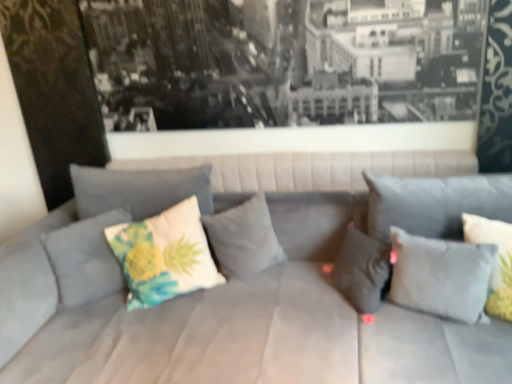
Question: Considering the relative sizes of floral fabric pillow at center, marked as the 6th pillow in a right-to-left arrangement, and white fabric pillow with pineapple print at center, which is the 2th pillow from left to right, in the image provided, is floral fabric pillow at center, marked as the 6th pillow in a right-to-left arrangement, shorter than white fabric pillow with pineapple print at center, which is the 2th pillow from left to right,?

Choices:
 (A) yes
 (B) no

Answer: (A)

Question: Does floral fabric pillow at center, marked as the 6th pillow in a right-to-left arrangement, come behind white fabric pillow with pineapple print at center, which is the 2th pillow from left to right?

Choices:
 (A) no
 (B) yes

Answer: (B)

Question: Is floral fabric pillow at center, marked as the 6th pillow in a right-to-left arrangement, aimed at white fabric pillow with pineapple print at center, the 5th pillow from the right?

Choices:
 (A) yes
 (B) no

Answer: (B)

Question: From a real-world perspective, is floral fabric pillow at center, marked as the 6th pillow in a right-to-left arrangement, physically above white fabric pillow with pineapple print at center, which is the 2th pillow from left to right?

Choices:
 (A) yes
 (B) no

Answer: (B)

Question: Is floral fabric pillow at center, which appears as the first pillow when viewed from the left, to the left of white fabric pillow with pineapple print at center, the 5th pillow from the right, from the viewer's perspective?

Choices:
 (A) yes
 (B) no

Answer: (A)

Question: Is the position of floral fabric pillow at center, marked as the 6th pillow in a right-to-left arrangement, less distant than that of white fabric pillow with pineapple print at center, the 5th pillow from the right?

Choices:
 (A) no
 (B) yes

Answer: (A)

Question: Is white fabric pillow with pineapple print at center, which is the 2th pillow from left to right, far away from gray fabric pillow at center, marked as the fourth pillow in a left-to-right arrangement?

Choices:
 (A) no
 (B) yes

Answer: (A)

Question: Considering the relative sizes of white fabric pillow with pineapple print at center, the 5th pillow from the right, and gray fabric pillow at center, marked as the fourth pillow in a left-to-right arrangement, in the image provided, is white fabric pillow with pineapple print at center, the 5th pillow from the right, bigger than gray fabric pillow at center, marked as the fourth pillow in a left-to-right arrangement,?

Choices:
 (A) yes
 (B) no

Answer: (A)

Question: Can you confirm if white fabric pillow with pineapple print at center, the 5th pillow from the right, is thinner than gray fabric pillow at center, marked as the 3th pillow in a right-to-left arrangement?

Choices:
 (A) no
 (B) yes

Answer: (B)

Question: Considering the relative sizes of white fabric pillow with pineapple print at center, the 5th pillow from the right, and gray fabric pillow at center, marked as the 3th pillow in a right-to-left arrangement, in the image provided, is white fabric pillow with pineapple print at center, the 5th pillow from the right, wider than gray fabric pillow at center, marked as the 3th pillow in a right-to-left arrangement,?

Choices:
 (A) yes
 (B) no

Answer: (B)

Question: From the image's perspective, is white fabric pillow with pineapple print at center, the 5th pillow from the right, beneath gray fabric pillow at center, marked as the 3th pillow in a right-to-left arrangement?

Choices:
 (A) yes
 (B) no

Answer: (B)

Question: Are white fabric pillow with pineapple print at center, the 5th pillow from the right, and gray fabric pillow at center, marked as the fourth pillow in a left-to-right arrangement, making contact?

Choices:
 (A) yes
 (B) no

Answer: (B)

Question: Does floral fabric pillow at center, which appears as the first pillow when viewed from the left, lie behind white fabric pillow at right, the 6th pillow positioned from the left?

Choices:
 (A) no
 (B) yes

Answer: (B)